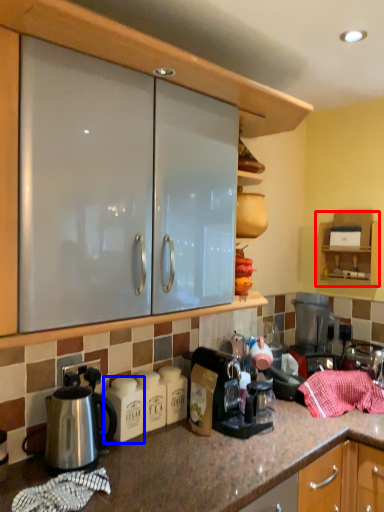
Question: Which object is closer to the camera taking this photo, cabinetry (highlighted by a red box) or appliance (highlighted by a blue box)?

Choices:
 (A) cabinetry
 (B) appliance

Answer: (B)